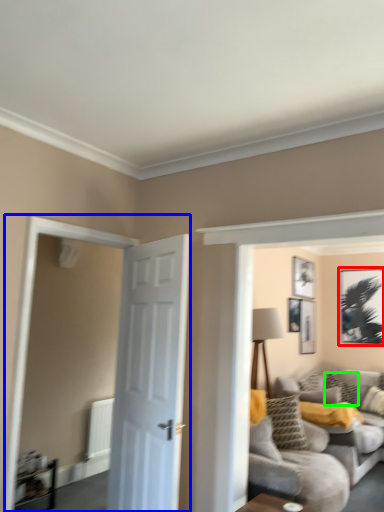
Question: Estimate the real-world distances between objects in this image. Which object is closer to picture frame (highlighted by a red box), glass door (highlighted by a blue box) or pillow (highlighted by a green box)?

Choices:
 (A) glass door
 (B) pillow

Answer: (B)